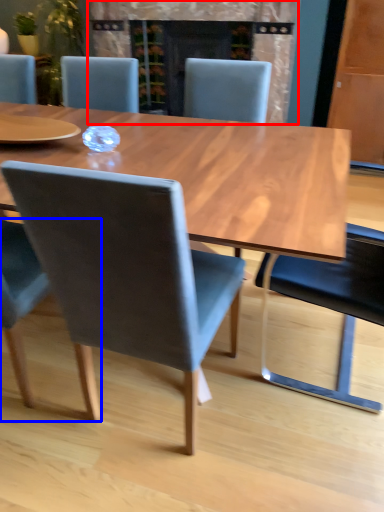
Question: Which point is closer to the camera, fireplace (highlighted by a red box) or chair (highlighted by a blue box)?

Choices:
 (A) fireplace
 (B) chair

Answer: (B)